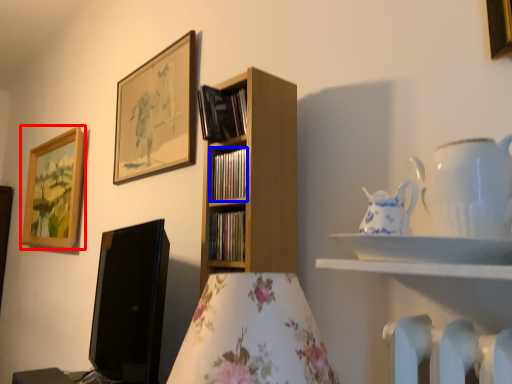
Question: Which point is further to the camera, picture frame (highlighted by a red box) or book (highlighted by a blue box)?

Choices:
 (A) picture frame
 (B) book

Answer: (A)